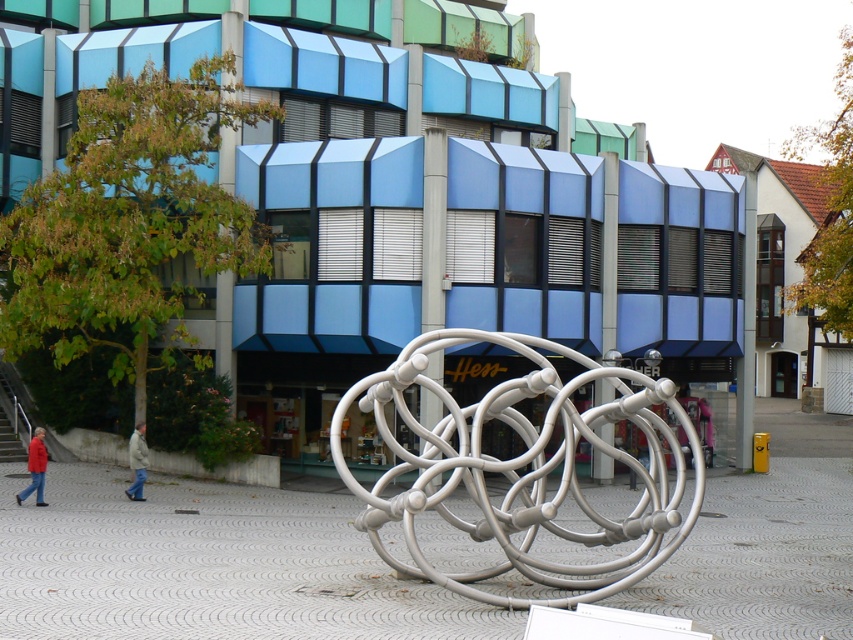
Describe the element at coordinates (35, 467) in the screenshot. The image size is (853, 640). I see `red jacket at lower left` at that location.

The width and height of the screenshot is (853, 640). In order to click on red jacket at lower left in this screenshot , I will do `click(35, 467)`.

Who is shorter, white metallic sculpture at center or light beige jacket at lower left?

With less height is light beige jacket at lower left.

Can you confirm if white metallic sculpture at center is taller than light beige jacket at lower left?

Yes, white metallic sculpture at center is taller than light beige jacket at lower left.

Between point (581, 596) and point (144, 444), which one is positioned in front?

Point (581, 596) is in front.

What are the coordinates of `white metallic sculpture at center` in the screenshot? It's located at (525, 468).

Is white metallic sculpture at center thinner than red jacket at lower left?

In fact, white metallic sculpture at center might be wider than red jacket at lower left.

Who is positioned more to the left, white metallic sculpture at center or red jacket at lower left?

red jacket at lower left is more to the left.

Image resolution: width=853 pixels, height=640 pixels. I want to click on white metallic sculpture at center, so click(x=525, y=468).